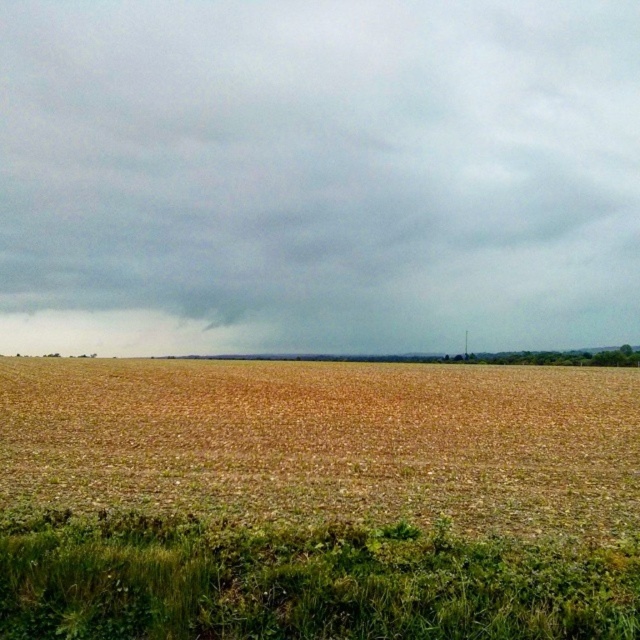
Question: Considering the relative positions of gray cloudy sky at upper center and brown dry grass at center in the image provided, where is gray cloudy sky at upper center located with respect to brown dry grass at center?

Choices:
 (A) right
 (B) left

Answer: (A)

Question: Which object appears closest to the camera in this image?

Choices:
 (A) gray cloudy sky at upper center
 (B) brown dry grass at center

Answer: (B)

Question: Can you confirm if gray cloudy sky at upper center is wider than brown dry grass at center?

Choices:
 (A) yes
 (B) no

Answer: (A)

Question: Does gray cloudy sky at upper center lie in front of brown dry grass at center?

Choices:
 (A) yes
 (B) no

Answer: (B)